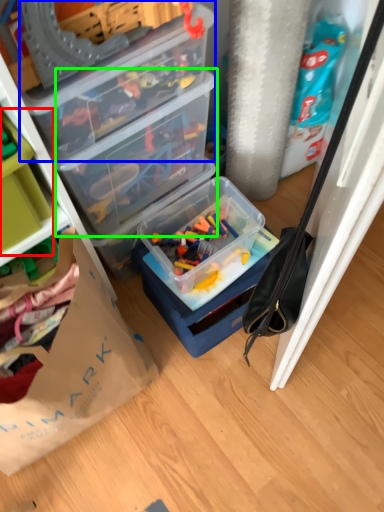
Question: Based on their relative distances, which object is nearer to storage box (highlighted by a red box)? Choose from box (highlighted by a blue box) and box (highlighted by a green box).

Choices:
 (A) box
 (B) box

Answer: (A)